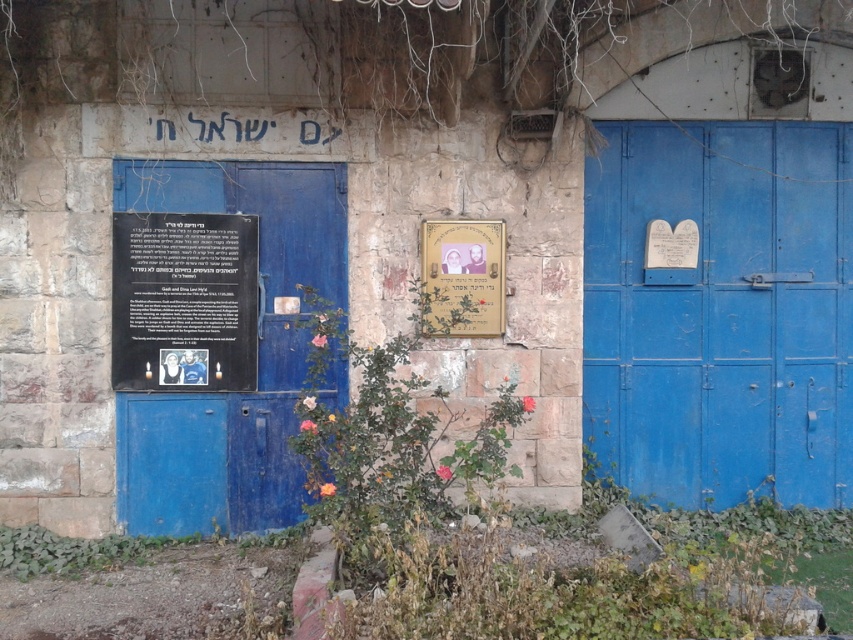
Is blue matte door at center behind black matte signboard at left?

Yes, blue matte door at center is behind black matte signboard at left.

Is point (651, 192) farther from viewer compared to point (119, 273)?

Yes.

The width and height of the screenshot is (853, 640). I want to click on blue matte door at center, so click(x=721, y=312).

Which is below, blue matte door at center or green leafy plant at center?

green leafy plant at center is below.

Between blue matte door at center and green leafy plant at center, which one has less height?

green leafy plant at center

What do you see at coordinates (721, 312) in the screenshot?
I see `blue matte door at center` at bounding box center [721, 312].

Where is `blue matte door at center`? The height and width of the screenshot is (640, 853). blue matte door at center is located at coordinates click(x=721, y=312).

Who is higher up, green leafy plant at center or black matte signboard at left?

Positioned higher is black matte signboard at left.

Measure the distance from green leafy plant at center to black matte signboard at left.

green leafy plant at center and black matte signboard at left are 1.12 meters apart.

Where is `green leafy plant at center`? green leafy plant at center is located at coordinates (390, 433).